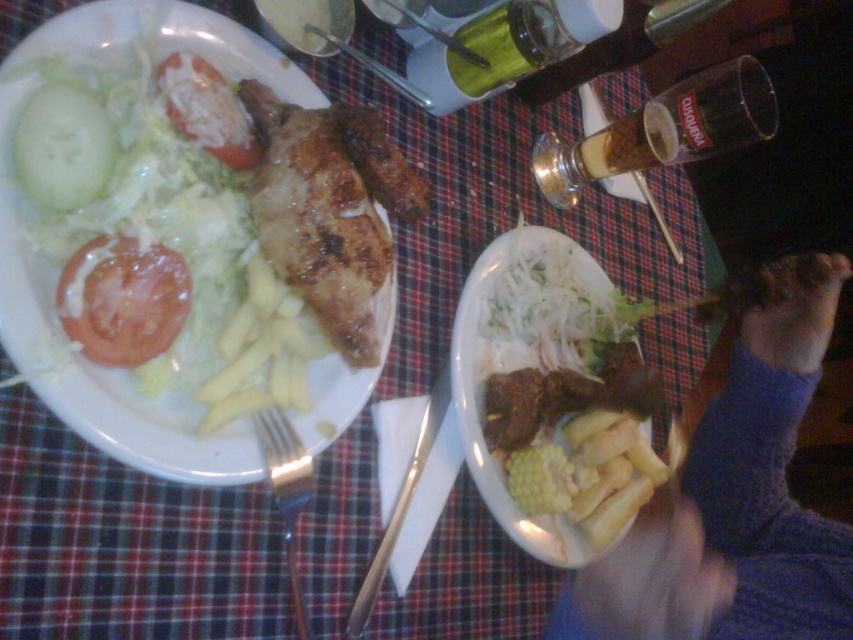
Can you confirm if matte brown meat at center is thinner than metallic spoon at upper center?

No, matte brown meat at center is not thinner than metallic spoon at upper center.

Is point (469, 448) behind point (618, 188)?

No, (469, 448) is closer to viewer.

Locate an element on the screen. This screenshot has width=853, height=640. matte brown meat at center is located at coordinates (479, 388).

Which is more to the right, blue knitted sweater at lower right or brushed metal fork at upper center?

From the viewer's perspective, blue knitted sweater at lower right appears more on the right side.

Does blue knitted sweater at lower right appear on the right side of brushed metal fork at upper center?

Indeed, blue knitted sweater at lower right is positioned on the right side of brushed metal fork at upper center.

Between point (836, 604) and point (405, 92), which one is positioned in front?

Point (836, 604)

Find the location of a particular element. This screenshot has width=853, height=640. blue knitted sweater at lower right is located at coordinates (735, 499).

Is matte brown meat at center smaller than silver metallic fork at lower left?

Incorrect, matte brown meat at center is not smaller in size than silver metallic fork at lower left.

Does matte brown meat at center lie in front of silver metallic fork at lower left?

That is False.

The width and height of the screenshot is (853, 640). I want to click on matte brown meat at center, so click(x=479, y=388).

Find the location of a particular element. The height and width of the screenshot is (640, 853). matte brown meat at center is located at coordinates (479, 388).